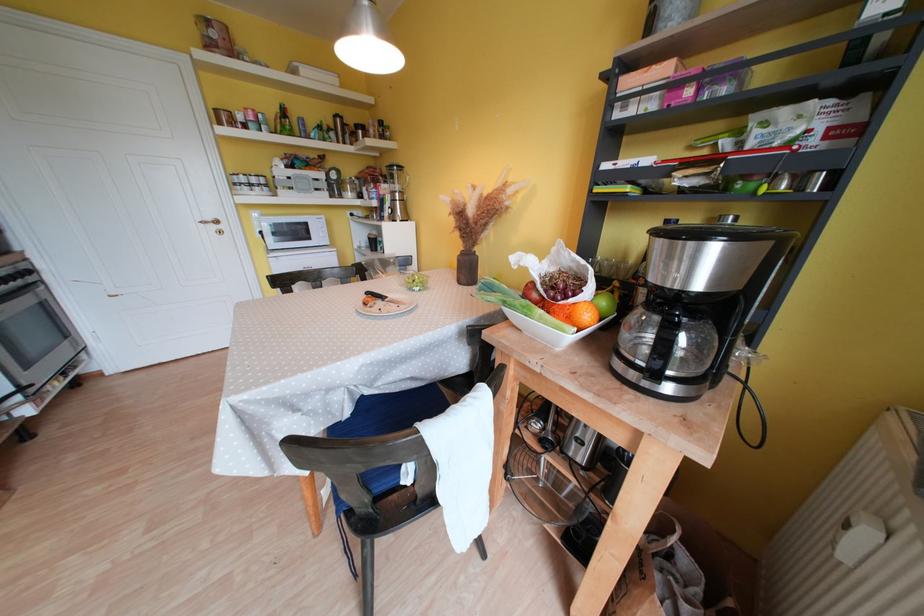
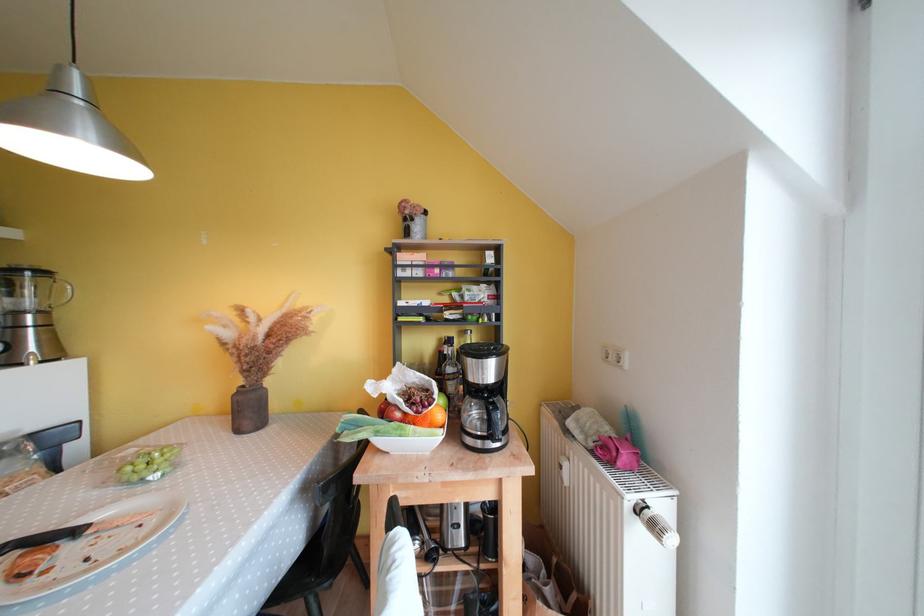
Where in the second image is the point corresponding to pixel 407 196 from the first image?

(49, 315)